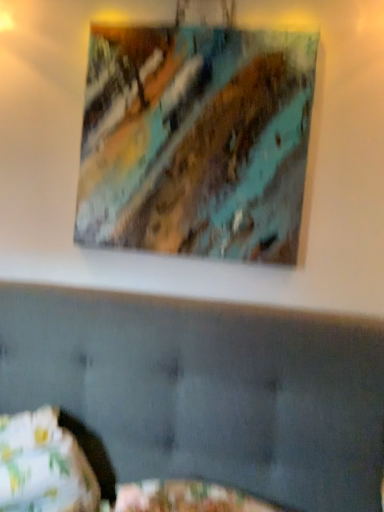
Question: Is matte acrylic painting at upper center at the right side of fluffy fabric pillow at lower left?

Choices:
 (A) yes
 (B) no

Answer: (A)

Question: Is matte acrylic painting at upper center turned away from fluffy fabric pillow at lower left?

Choices:
 (A) yes
 (B) no

Answer: (B)

Question: Is fluffy fabric pillow at lower left completely or partially inside matte acrylic painting at upper center?

Choices:
 (A) no
 (B) yes

Answer: (A)

Question: From a real-world perspective, is matte acrylic painting at upper center beneath fluffy fabric pillow at lower left?

Choices:
 (A) no
 (B) yes

Answer: (A)

Question: Is matte acrylic painting at upper center placed right next to fluffy fabric pillow at lower left?

Choices:
 (A) yes
 (B) no

Answer: (B)

Question: From a real-world perspective, is matte acrylic painting at upper center on fluffy fabric pillow at lower left?

Choices:
 (A) no
 (B) yes

Answer: (B)

Question: Is fluffy fabric pillow at lower left not inside matte acrylic painting at upper center?

Choices:
 (A) yes
 (B) no

Answer: (A)

Question: From a real-world perspective, is fluffy fabric pillow at lower left beneath matte acrylic painting at upper center?

Choices:
 (A) yes
 (B) no

Answer: (A)

Question: Considering the relative positions of fluffy fabric pillow at lower left and matte acrylic painting at upper center in the image provided, is fluffy fabric pillow at lower left behind matte acrylic painting at upper center?

Choices:
 (A) yes
 (B) no

Answer: (B)

Question: From the image's perspective, would you say fluffy fabric pillow at lower left is positioned over matte acrylic painting at upper center?

Choices:
 (A) no
 (B) yes

Answer: (A)

Question: Is matte acrylic painting at upper center at the back of fluffy fabric pillow at lower left?

Choices:
 (A) yes
 (B) no

Answer: (B)

Question: Can you confirm if fluffy fabric pillow at lower left is bigger than matte acrylic painting at upper center?

Choices:
 (A) yes
 (B) no

Answer: (A)

Question: Is matte acrylic painting at upper center situated inside fluffy fabric pillow at lower left or outside?

Choices:
 (A) outside
 (B) inside

Answer: (A)